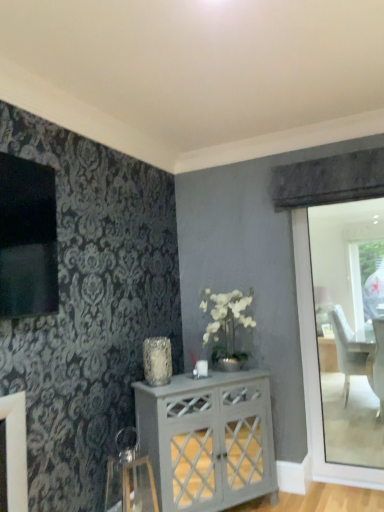
The image size is (384, 512). I want to click on translucent glass vase at center, so click(157, 361).

The image size is (384, 512). I want to click on white painted wood cabinet at center, so click(x=208, y=439).

Between point (203, 498) and point (125, 448), which one is positioned in front?

Point (203, 498)

From a real-world perspective, is white painted wood cabinet at center positioned over metallic silver swivel chair at lower left based on gravity?

Yes, from a real-world perspective, white painted wood cabinet at center is over metallic silver swivel chair at lower left

Which is more to the right, white painted wood cabinet at center or metallic silver swivel chair at lower left?

From the viewer's perspective, white painted wood cabinet at center appears more on the right side.

Which of these two, white painted wood cabinet at center or metallic silver swivel chair at lower left, is wider?

With larger width is white painted wood cabinet at center.

Can you see metallic silver swivel chair at lower left touching white painted wood cabinet at center?

No, metallic silver swivel chair at lower left is not touching white painted wood cabinet at center.

Does metallic silver swivel chair at lower left have a greater width compared to white painted wood cabinet at center?

No, metallic silver swivel chair at lower left is not wider than white painted wood cabinet at center.

Based on the photo, from the image's perspective, relative to white painted wood cabinet at center, is metallic silver swivel chair at lower left above or below?

metallic silver swivel chair at lower left is situated lower than white painted wood cabinet at center in the image.

Considering the points (122, 436) and (269, 405), which point is behind, point (122, 436) or point (269, 405)?

The point (269, 405) is farther.

From the image's perspective, which one is positioned lower, translucent glass vase at center or metallic silver swivel chair at lower left?

From the image's view, metallic silver swivel chair at lower left is below.

Looking at this image, does translucent glass vase at center have a greater width compared to metallic silver swivel chair at lower left?

No, translucent glass vase at center is not wider than metallic silver swivel chair at lower left.

From a real-world perspective, relative to metallic silver swivel chair at lower left, is translucent glass vase at center vertically above or below?

In terms of real-world spatial position, translucent glass vase at center is above metallic silver swivel chair at lower left.

At what (x,y) coordinates should I click in order to perform the action: click on swivel chair on the left of translucent glass vase at center. Please return your answer as a coordinate pair (x, y). This screenshot has width=384, height=512. Looking at the image, I should click on (129, 477).

Based on their sizes in the image, would you say white painted wood cabinet at center is bigger or smaller than translucent glass vase at center?

Clearly, white painted wood cabinet at center is larger in size than translucent glass vase at center.

Can you tell me how much white painted wood cabinet at center and translucent glass vase at center differ in facing direction?

They differ by 0.000108 degrees in their facing directions.

Does white painted wood cabinet at center have a greater height compared to translucent glass vase at center?

Yes.

Which is nearer, (232, 466) or (165, 343)?

Clearly, point (232, 466) is closer to the camera than point (165, 343).

Which is more to the right, metallic silver swivel chair at lower left or translucent glass vase at center?

translucent glass vase at center is more to the right.

From a real-world perspective, is metallic silver swivel chair at lower left above or below translucent glass vase at center?

metallic silver swivel chair at lower left is situated lower than translucent glass vase at center in the real world.

From the image's perspective, which one is positioned higher, metallic silver swivel chair at lower left or translucent glass vase at center?

translucent glass vase at center is shown above in the image.

Which is in front, metallic silver swivel chair at lower left or translucent glass vase at center?

metallic silver swivel chair at lower left is in front.

Considering the relative sizes of translucent glass vase at center and white painted wood cabinet at center in the image provided, is translucent glass vase at center smaller than white painted wood cabinet at center?

Yes, translucent glass vase at center is smaller than white painted wood cabinet at center.

Consider the image. Is white painted wood cabinet at center surrounded by translucent glass vase at center?

No, white painted wood cabinet at center is not surrounded by translucent glass vase at center.

Between translucent glass vase at center and white painted wood cabinet at center, which one is positioned in front?

Positioned in front is white painted wood cabinet at center.

Can you confirm if translucent glass vase at center is positioned to the left of white painted wood cabinet at center?

Yes, translucent glass vase at center is to the left of white painted wood cabinet at center.

You are a GUI agent. You are given a task and a screenshot of the screen. Output one action in this format:
    pyautogui.click(x=<x>, y=<y>)
    Task: Click on the swivel chair below the white painted wood cabinet at center (from the image's perspective)
    The height and width of the screenshot is (512, 384).
    Given the screenshot: What is the action you would take?
    pyautogui.click(x=129, y=477)

The image size is (384, 512). What are the coordinates of `desk behind the metallic silver swivel chair at lower left` in the screenshot? It's located at (208, 439).

In the scene shown: Considering their positions, is translucent glass vase at center positioned closer to white painted wood cabinet at center than metallic silver swivel chair at lower left?

Based on the image, metallic silver swivel chair at lower left appears to be nearer to white painted wood cabinet at center.

Which object lies nearer to the anchor point translucent glass vase at center, white painted wood cabinet at center or metallic silver swivel chair at lower left?

white painted wood cabinet at center lies closer to translucent glass vase at center than the other object.

From the image, which object appears to be farther from translucent glass vase at center, metallic silver swivel chair at lower left or white painted wood cabinet at center?

metallic silver swivel chair at lower left is positioned further to the anchor translucent glass vase at center.

Considering their positions, is metallic silver swivel chair at lower left positioned further to white painted wood cabinet at center than translucent glass vase at center?

The object further to white painted wood cabinet at center is translucent glass vase at center.

Looking at the image, which one is located further to metallic silver swivel chair at lower left, white painted wood cabinet at center or translucent glass vase at center?

The object further to metallic silver swivel chair at lower left is translucent glass vase at center.

Which object lies nearer to the anchor point metallic silver swivel chair at lower left, translucent glass vase at center or white painted wood cabinet at center?

The object closer to metallic silver swivel chair at lower left is white painted wood cabinet at center.

Where is `desk between translucent glass vase at center and metallic silver swivel chair at lower left from top to bottom`? This screenshot has width=384, height=512. desk between translucent glass vase at center and metallic silver swivel chair at lower left from top to bottom is located at coordinates (208, 439).